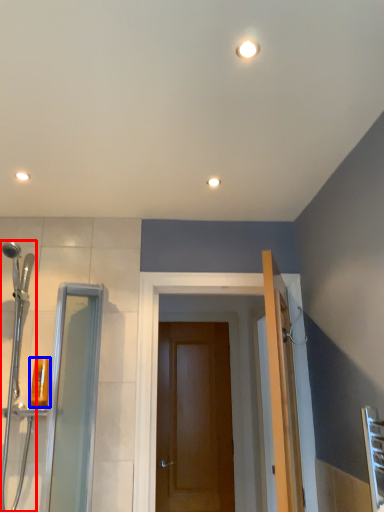
Question: Which point is further to the camera, shower door (highlighted by a red box) or toiletry (highlighted by a blue box)?

Choices:
 (A) shower door
 (B) toiletry

Answer: (B)